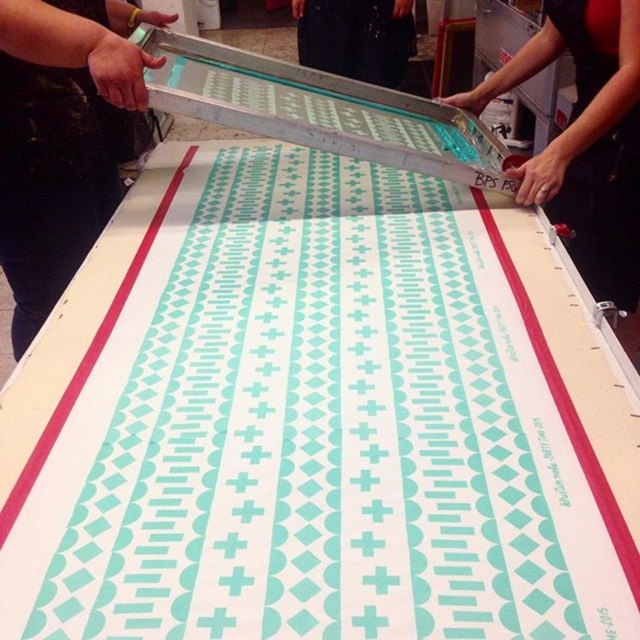
Question: Is black fabric at upper left smaller than black fabric at center?

Choices:
 (A) no
 (B) yes

Answer: (A)

Question: Which point is closer to the camera?

Choices:
 (A) (566, 20)
 (B) (13, 259)

Answer: (B)

Question: Estimate the real-world distances between objects in this image. Which object is closer to the metallic silver tool at upper center?

Choices:
 (A) black fabric at upper left
 (B) black fabric at center

Answer: (A)

Question: Considering the relative positions of black fabric at upper left and black fabric at center in the image provided, where is black fabric at upper left located with respect to black fabric at center?

Choices:
 (A) below
 (B) above

Answer: (A)

Question: Which point is closer to the camera?

Choices:
 (A) metallic silver tool at upper center
 (B) black fabric at upper left
 (C) black fabric at center

Answer: (B)

Question: Does black fabric at upper left appear under black fabric at center?

Choices:
 (A) no
 (B) yes

Answer: (B)